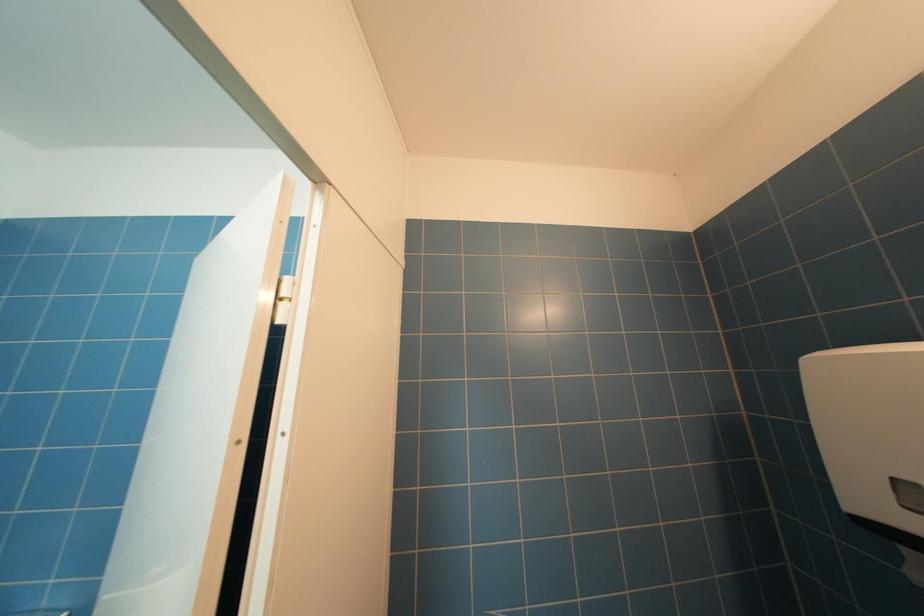
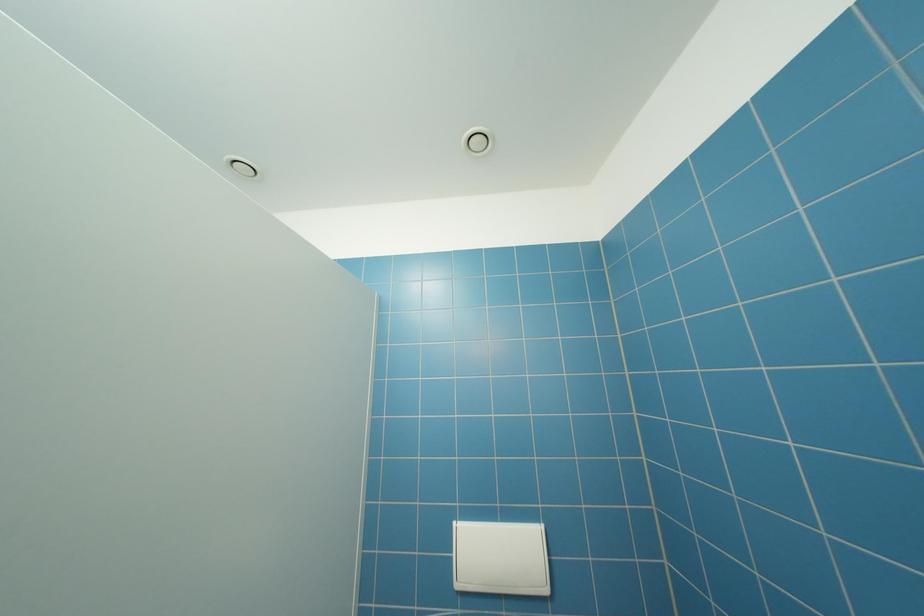
Question: How did the camera likely rotate?

Choices:
 (A) Left
 (B) Right
 (C) Up
 (D) Down

Answer: (A)